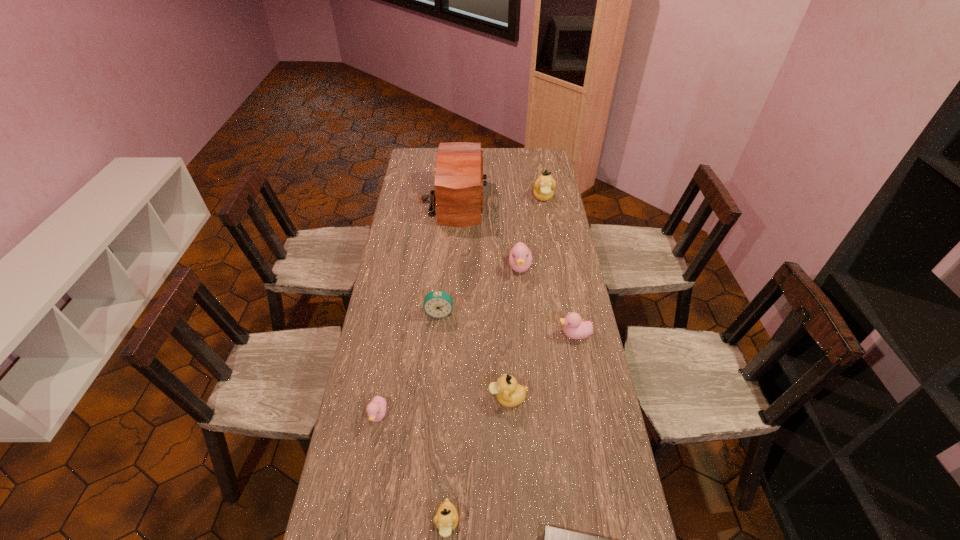
This screenshot has width=960, height=540. I want to click on duckling that is the fifth closest to the rightmost pink duckling, so click(544, 186).

Locate an element on the screen. This screenshot has height=540, width=960. tan duckling that is the second closest to the shortest duckling is located at coordinates (509, 393).

In order to click on tan duckling that is the nearest to the dark book in this screenshot , I will do `click(446, 519)`.

Locate which pink duckling ranks third in proximity to the second nearest tan duckling. Please provide its 2D coordinates. Your answer should be formatted as a tuple, i.e. [(x, y)], where the tuple contains the x and y coordinates of a point satisfying the conditions above.

[(520, 259)]

The image size is (960, 540). I want to click on pink duckling that stands as the second closest to the tallest object, so click(x=575, y=328).

Image resolution: width=960 pixels, height=540 pixels. What are the coordinates of `free point that satisfies the following two spatial constraints: 1. on the front-facing side of the third farthest object; 2. on the face of the second tan duckling from left to right` in the screenshot? It's located at (532, 398).

Image resolution: width=960 pixels, height=540 pixels. What are the coordinates of `free spot that satisfies the following two spatial constraints: 1. on the front-facing side of the tallest object; 2. on the front-facing side of the nearest pink duckling` in the screenshot? It's located at (437, 415).

I want to click on free space that satisfies the following two spatial constraints: 1. on the face of the farthest tan duckling; 2. on the front-facing side of the radio receiver, so tap(544, 201).

Find the location of a particular element. free spot that satisfies the following two spatial constraints: 1. on the front-facing side of the tallest object; 2. on the front-facing side of the sixth nearest object is located at coordinates (444, 313).